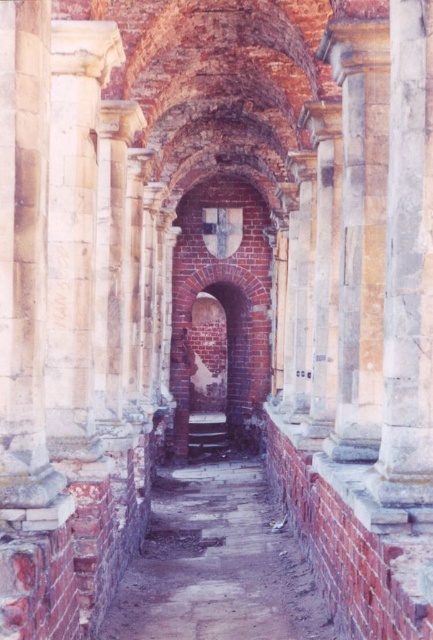
Question: Which object is farther from the camera taking this photo?

Choices:
 (A) smooth stone column at right
 (B) brick alley at center

Answer: (B)

Question: Is brick alley at center positioned at the back of smooth stone column at right?

Choices:
 (A) yes
 (B) no

Answer: (A)

Question: Which of the following is the farthest from the observer?

Choices:
 (A) (388, 236)
 (B) (229, 570)

Answer: (B)

Question: Can you confirm if brick alley at center is positioned to the right of smooth stone column at right?

Choices:
 (A) yes
 (B) no

Answer: (B)

Question: Observing the image, what is the correct spatial positioning of brick alley at center in reference to smooth stone column at right?

Choices:
 (A) left
 (B) right

Answer: (A)